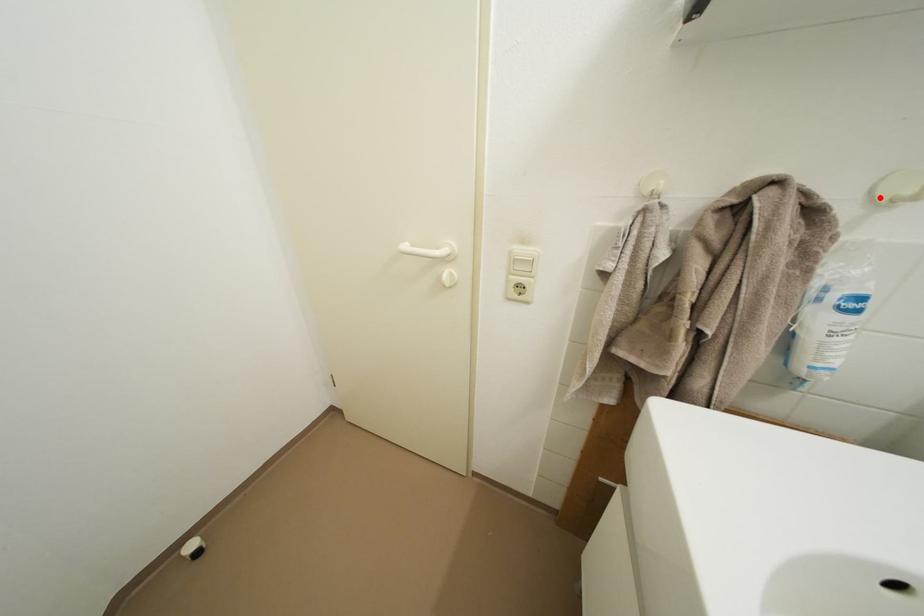
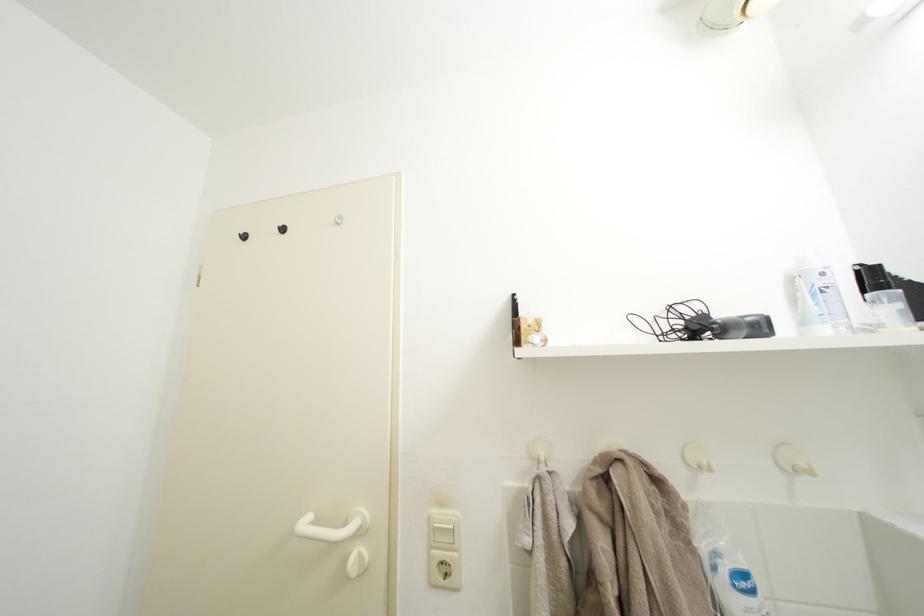
Find the pixel in the second image that matches the highlighted location in the first image.

(694, 464)